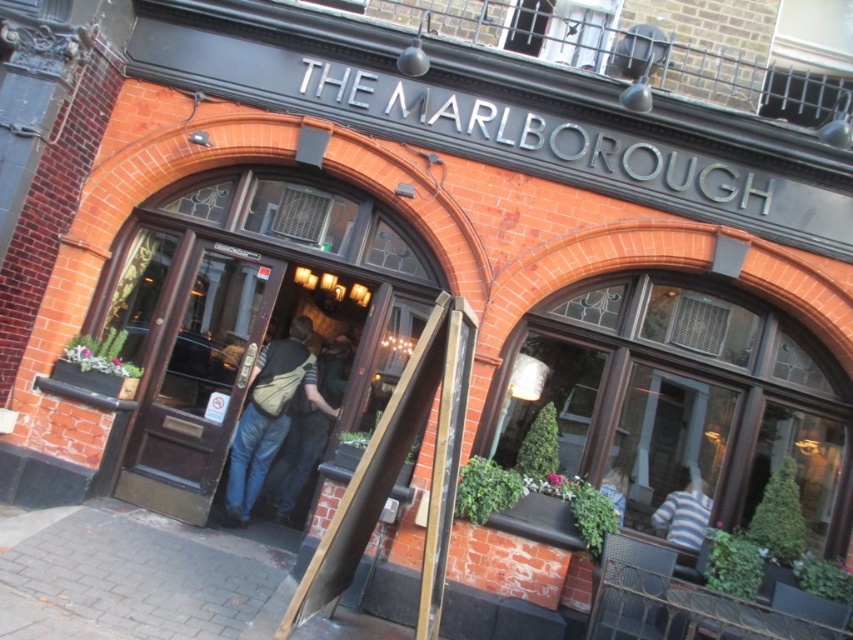
You are standing in front of The Marlborough pub. You notice a brown wooden door at center and a striped shirt at lower right. Which object is positioned higher from the ground?

The brown wooden door at center is located above striped shirt at lower right, so the brown wooden door at center is positioned higher from the ground.

You are standing at the entrance of The Marlborough pub and notice two points marked on the building. One is at coordinate point (244,465) and the other at point (695,493). From your position at the entrance, which point is closer to you?

Point (695,493) is closer to you because point (244,465) is behind it.